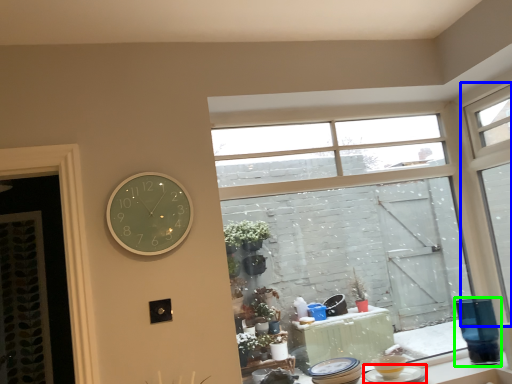
Question: Which object is the farthest from tableware (highlighted by a red box)? Choose among these: window (highlighted by a blue box) or glass vase (highlighted by a green box).

Choices:
 (A) window
 (B) glass vase

Answer: (A)